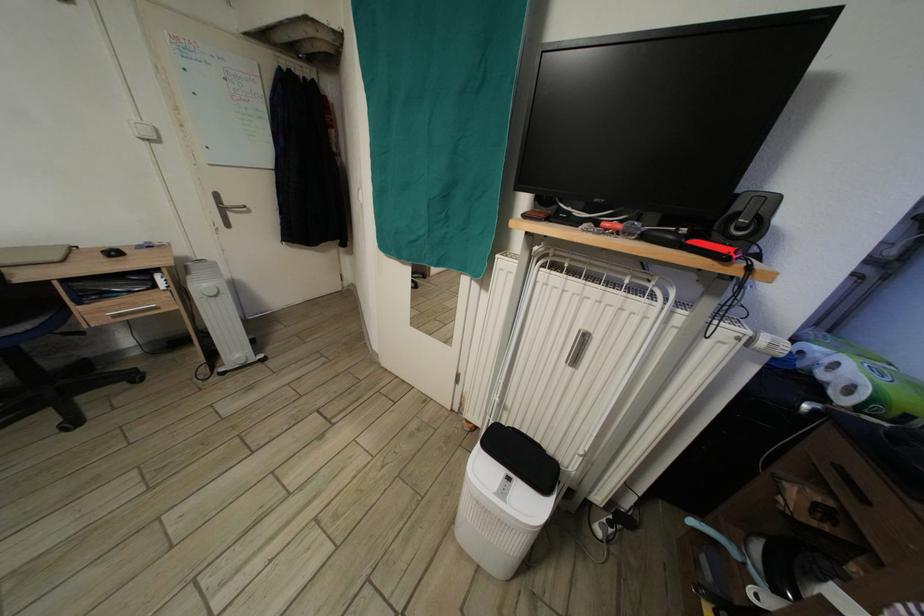
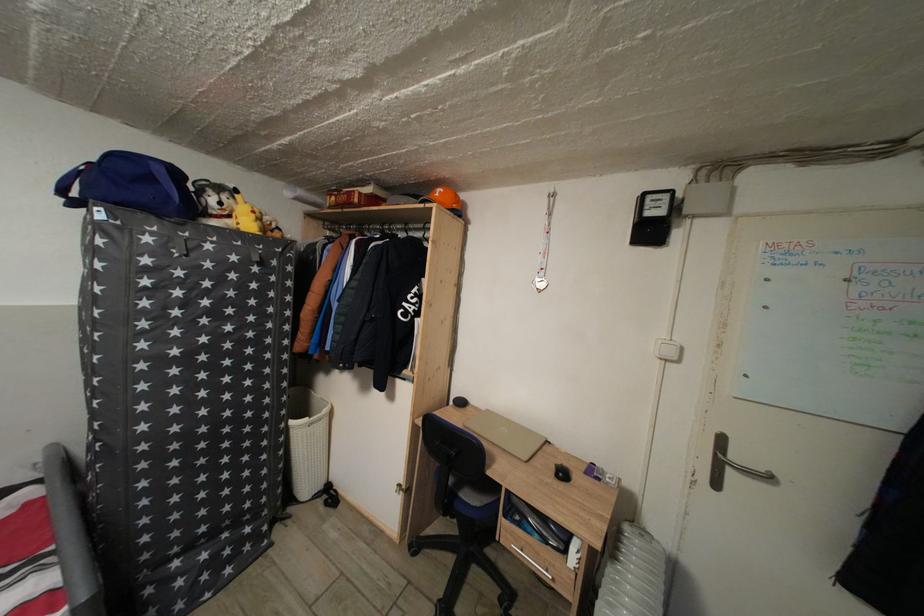
Question: Based on the continuous images, in which direction is the camera rotating? Reply with the corresponding letter.

Choices:
 (A) Left
 (B) Right
 (C) Up
 (D) Down

Answer: (A)